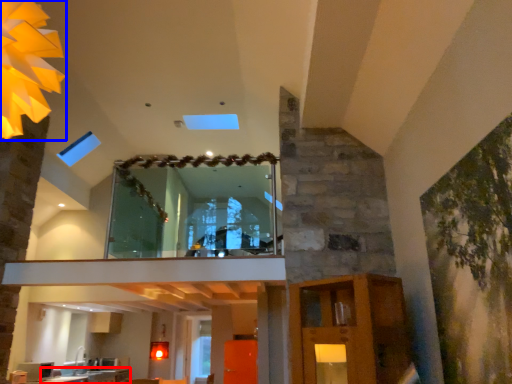
Question: Among these objects, which one is farthest to the camera, counter top (highlighted by a red box) or lighting (highlighted by a blue box)?

Choices:
 (A) counter top
 (B) lighting

Answer: (A)